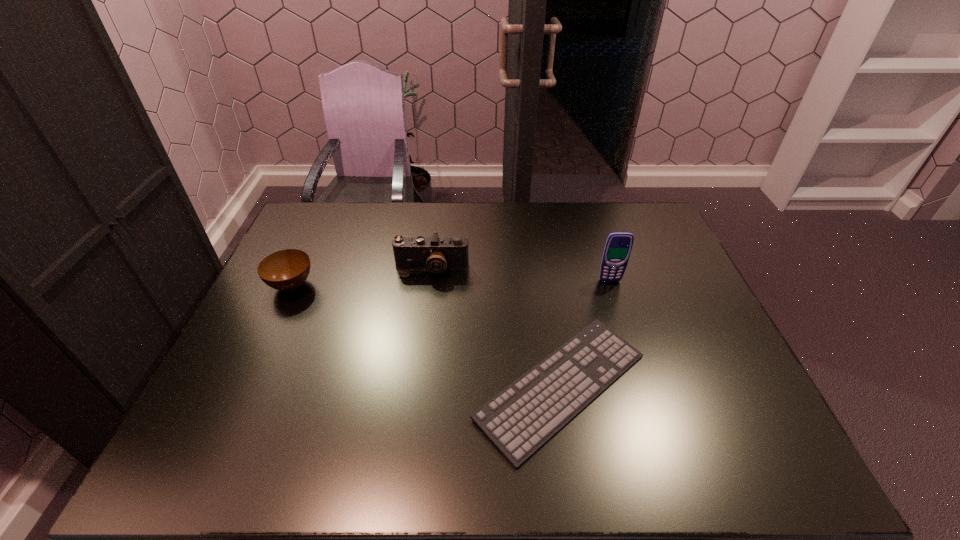
At what (x,y) coordinates should I click in order to perform the action: click on the tallest object. Please return your answer as a coordinate pair (x, y). The width and height of the screenshot is (960, 540). Looking at the image, I should click on (618, 245).

In order to click on the third shortest object in this screenshot , I will do `click(436, 254)`.

Image resolution: width=960 pixels, height=540 pixels. I want to click on the second object from left to right, so click(x=436, y=254).

Locate an element on the screen. The image size is (960, 540). the leftmost object is located at coordinates (285, 270).

The height and width of the screenshot is (540, 960). I want to click on the third tallest object, so click(x=285, y=270).

This screenshot has height=540, width=960. I want to click on the shortest object, so click(x=519, y=420).

Identify the location of the nearest object. This screenshot has width=960, height=540. (519, 420).

Locate an element on the screen. vacant space located 0.220m on the front-facing side of the cellular telephone is located at coordinates (629, 339).

At what (x,y) coordinates should I click in order to perform the action: click on vacant position located 0.110m on the front-facing side of the third shortest object. Please return your answer as a coordinate pair (x, y). The image size is (960, 540). Looking at the image, I should click on (427, 306).

This screenshot has width=960, height=540. In order to click on blank space located 0.280m on the back of the third tallest object in this screenshot , I will do `click(323, 218)`.